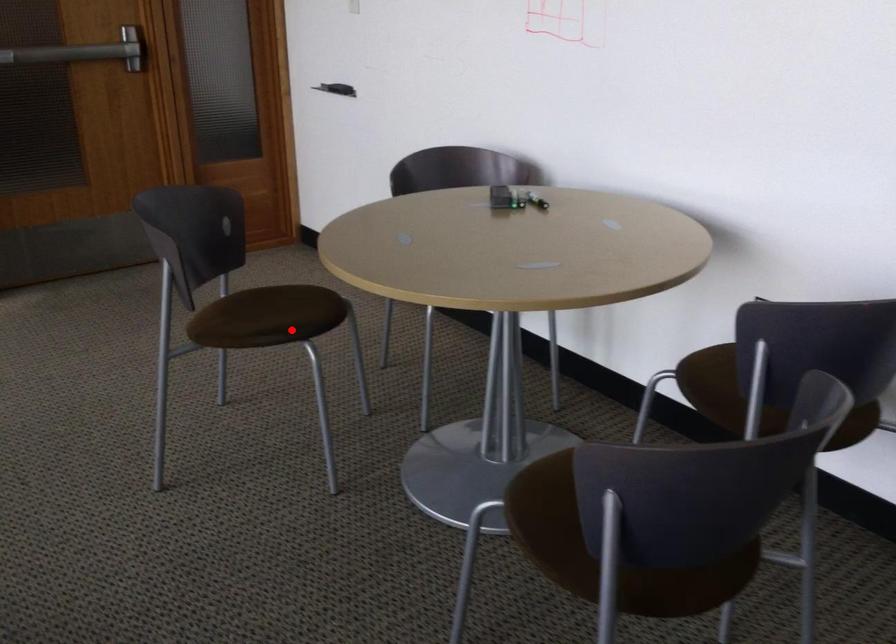
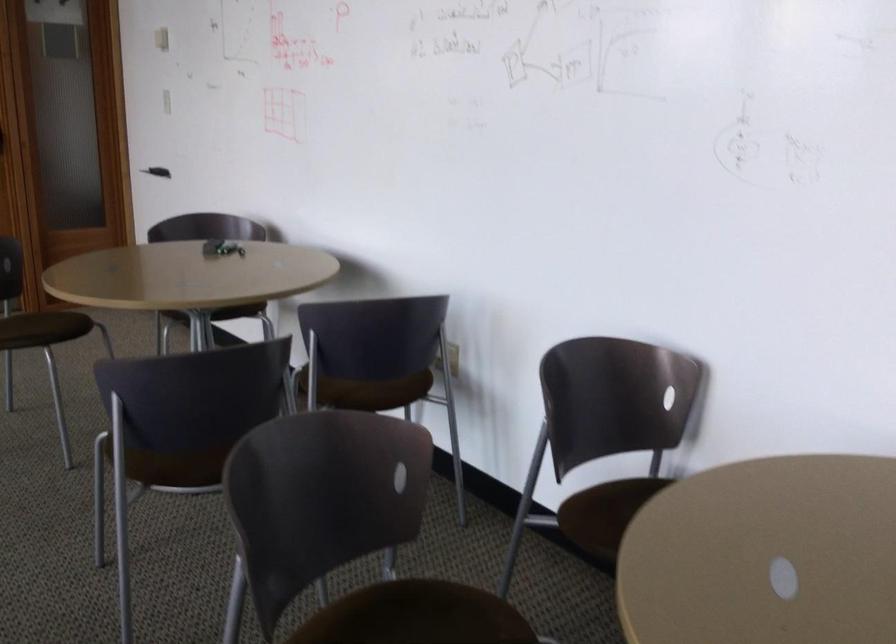
Find the pixel in the second image that matches the highlighted location in the first image.

(44, 328)